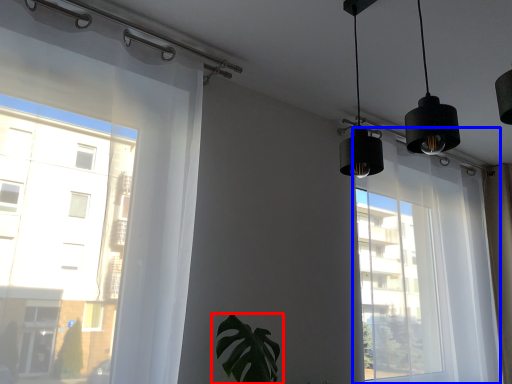
Question: Among these objects, which one is farthest to the camera, houseplant (highlighted by a red box) or bay window (highlighted by a blue box)?

Choices:
 (A) houseplant
 (B) bay window

Answer: (B)